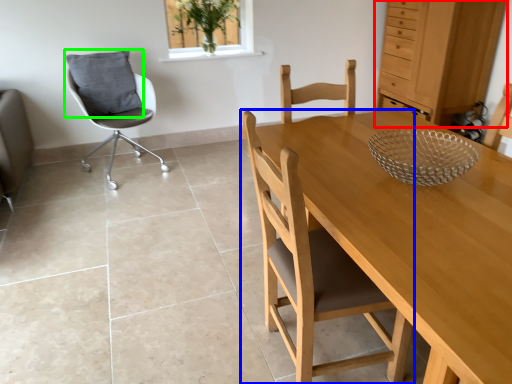
Question: Estimate the real-world distances between objects in this image. Which object is farther from dresser (highlighted by a red box), chair (highlighted by a blue box) or pillow (highlighted by a green box)?

Choices:
 (A) chair
 (B) pillow

Answer: (A)